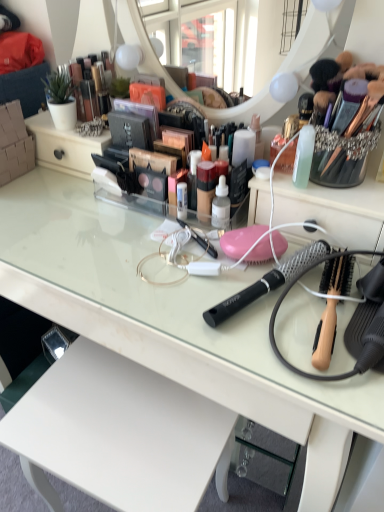
Image resolution: width=384 pixels, height=512 pixels. Describe the element at coordinates (265, 283) in the screenshot. I see `black mesh hairbrush at center, which appears as the second brush when viewed from the right` at that location.

At what (x,y) coordinates should I click in order to perform the action: click on wooden-handled hairbrush at right, the 2th brush in the left-to-right sequence. Please return your answer as a coordinate pair (x, y). Looking at the image, I should click on (331, 310).

Image resolution: width=384 pixels, height=512 pixels. I want to click on black mesh hairbrush at center, which appears as the second brush when viewed from the right, so click(x=265, y=283).

Considering the relative sizes of black mesh hairbrush at center, placed as the first brush when sorted from left to right, and wooden-handled hairbrush at right, the 2th brush in the left-to-right sequence, in the image provided, is black mesh hairbrush at center, placed as the first brush when sorted from left to right, thinner than wooden-handled hairbrush at right, the 2th brush in the left-to-right sequence,?

No.

Is point (281, 269) more distant than point (335, 278)?

Yes.

From the image's perspective, does black mesh hairbrush at center, placed as the first brush when sorted from left to right, appear higher than wooden-handled hairbrush at right, the first brush when ordered from right to left?

Yes, from the image's perspective, black mesh hairbrush at center, placed as the first brush when sorted from left to right, is over wooden-handled hairbrush at right, the first brush when ordered from right to left.

Considering the relative sizes of black mesh hairbrush at center, which appears as the second brush when viewed from the right, and wooden-handled hairbrush at right, the 2th brush in the left-to-right sequence, in the image provided, is black mesh hairbrush at center, which appears as the second brush when viewed from the right, smaller than wooden-handled hairbrush at right, the 2th brush in the left-to-right sequence,?

Correct, black mesh hairbrush at center, which appears as the second brush when viewed from the right, occupies less space than wooden-handled hairbrush at right, the 2th brush in the left-to-right sequence.

Does point (328, 298) appear closer or farther from the camera than point (371, 418)?

Point (328, 298).

You are a GUI agent. You are given a task and a screenshot of the screen. Output one action in this format:
    pyautogui.click(x=<x>, y=<y>)
    Task: Click on the desk in front of the wooden-handled hairbrush at right, the first brush when ordered from right to left
    Image resolution: width=384 pixels, height=512 pixels.
    Given the screenshot: What is the action you would take?
    pyautogui.click(x=172, y=321)

In the scene shown: Is wooden-handled hairbrush at right, the 2th brush in the left-to-right sequence, outside of clear glass desk at center?

Absolutely, wooden-handled hairbrush at right, the 2th brush in the left-to-right sequence, is external to clear glass desk at center.

Does wooden-handled hairbrush at right, the first brush when ordered from right to left, lie in front of clear glass desk at center?

No, wooden-handled hairbrush at right, the first brush when ordered from right to left, is behind clear glass desk at center.

Is clear glass desk at center located within metallic gold makeup at upper left?

No.

From a real-world perspective, is metallic gold makeup at upper left over clear glass desk at center?

Yes, from a real-world perspective, metallic gold makeup at upper left is above clear glass desk at center.

From the picture: Does metallic gold makeup at upper left turn towards clear glass desk at center?

No.

Considering the positions of objects metallic gold makeup at upper left and clear glass desk at center in the image provided, who is more to the left, metallic gold makeup at upper left or clear glass desk at center?

Positioned to the left is metallic gold makeup at upper left.

Is black mesh hairbrush at center, which appears as the second brush when viewed from the right, at the left side of clear glass desk at center?

In fact, black mesh hairbrush at center, which appears as the second brush when viewed from the right, is to the right of clear glass desk at center.

Which is closer to the camera, [288,278] or [295,297]?

Point [288,278].

From the image's perspective, which one is positioned higher, black mesh hairbrush at center, placed as the first brush when sorted from left to right, or clear glass desk at center?

black mesh hairbrush at center, placed as the first brush when sorted from left to right, is shown above in the image.

Considering the positions of objects black mesh hairbrush at center, which appears as the second brush when viewed from the right, and clear glass desk at center in the image provided, who is behind, black mesh hairbrush at center, which appears as the second brush when viewed from the right, or clear glass desk at center?

black mesh hairbrush at center, which appears as the second brush when viewed from the right.

Can you confirm if black mesh hairbrush at center, placed as the first brush when sorted from left to right, is bigger than metallic gold makeup at upper left?

Incorrect, black mesh hairbrush at center, placed as the first brush when sorted from left to right, is not larger than metallic gold makeup at upper left.

Is black mesh hairbrush at center, placed as the first brush when sorted from left to right, shorter than metallic gold makeup at upper left?

Yes.

Looking at this image, would you say metallic gold makeup at upper left is part of black mesh hairbrush at center, which appears as the second brush when viewed from the right,'s contents?

No, metallic gold makeup at upper left is not surrounded by black mesh hairbrush at center, which appears as the second brush when viewed from the right.

From the image's perspective, relative to metallic gold makeup at upper left, is black mesh hairbrush at center, which appears as the second brush when viewed from the right, above or below?

From the image's perspective, black mesh hairbrush at center, which appears as the second brush when viewed from the right, appears below metallic gold makeup at upper left.

From the picture: Considering the positions of objects metallic gold makeup at upper left and black mesh hairbrush at center, placed as the first brush when sorted from left to right, in the image provided, who is in front, metallic gold makeup at upper left or black mesh hairbrush at center, placed as the first brush when sorted from left to right,?

black mesh hairbrush at center, placed as the first brush when sorted from left to right, is more forward.

Is metallic gold makeup at upper left taller than black mesh hairbrush at center, placed as the first brush when sorted from left to right?

Yes, metallic gold makeup at upper left is taller than black mesh hairbrush at center, placed as the first brush when sorted from left to right.

Are metallic gold makeup at upper left and black mesh hairbrush at center, which appears as the second brush when viewed from the right, located far from each other?

That's not correct — metallic gold makeup at upper left is a little close to black mesh hairbrush at center, which appears as the second brush when viewed from the right.

Considering the relative sizes of metallic gold makeup at upper left and black mesh hairbrush at center, which appears as the second brush when viewed from the right, in the image provided, is metallic gold makeup at upper left wider than black mesh hairbrush at center, which appears as the second brush when viewed from the right,?

No.

Is there a large distance between wooden-handled hairbrush at right, the 2th brush in the left-to-right sequence, and black mesh hairbrush at center, placed as the first brush when sorted from left to right?

No.

Would you say wooden-handled hairbrush at right, the 2th brush in the left-to-right sequence, is inside or outside black mesh hairbrush at center, placed as the first brush when sorted from left to right?

wooden-handled hairbrush at right, the 2th brush in the left-to-right sequence, is spatially situated outside black mesh hairbrush at center, placed as the first brush when sorted from left to right.

What's the angular difference between wooden-handled hairbrush at right, the first brush when ordered from right to left, and black mesh hairbrush at center, placed as the first brush when sorted from left to right,'s facing directions?

The facing directions of wooden-handled hairbrush at right, the first brush when ordered from right to left, and black mesh hairbrush at center, placed as the first brush when sorted from left to right, are 29.5 degrees apart.

Identify the location of brush below the black mesh hairbrush at center, which appears as the second brush when viewed from the right (from the image's perspective). (331, 310).

The width and height of the screenshot is (384, 512). I want to click on brush located above the wooden-handled hairbrush at right, the first brush when ordered from right to left (from the image's perspective), so click(265, 283).

At what (x,y) coordinates should I click in order to perform the action: click on the 1st brush behind the clear glass desk at center. Please return your answer as a coordinate pair (x, y). Image resolution: width=384 pixels, height=512 pixels. Looking at the image, I should click on (331, 310).

Estimate the real-world distances between objects in this image. Which object is further from wooden-handled hairbrush at right, the first brush when ordered from right to left, black mesh hairbrush at center, which appears as the second brush when viewed from the right, or clear glass desk at center?

The object further to wooden-handled hairbrush at right, the first brush when ordered from right to left, is clear glass desk at center.

Based on their spatial positions, is clear glass desk at center or wooden-handled hairbrush at right, the 2th brush in the left-to-right sequence, closer to metallic gold makeup at upper left?

clear glass desk at center is closer to metallic gold makeup at upper left.

From the image, which object appears to be farther from metallic gold makeup at upper left, wooden-handled hairbrush at right, the 2th brush in the left-to-right sequence, or clear glass desk at center?

Among the two, wooden-handled hairbrush at right, the 2th brush in the left-to-right sequence, is located further to metallic gold makeup at upper left.

Considering their positions, is clear glass desk at center positioned closer to wooden-handled hairbrush at right, the 2th brush in the left-to-right sequence, than metallic gold makeup at upper left?

Among the two, clear glass desk at center is located nearer to wooden-handled hairbrush at right, the 2th brush in the left-to-right sequence.

Based on their spatial positions, is clear glass desk at center or black mesh hairbrush at center, placed as the first brush when sorted from left to right, closer to wooden-handled hairbrush at right, the 2th brush in the left-to-right sequence?

black mesh hairbrush at center, placed as the first brush when sorted from left to right, lies closer to wooden-handled hairbrush at right, the 2th brush in the left-to-right sequence, than the other object.

Which object lies further to the anchor point wooden-handled hairbrush at right, the first brush when ordered from right to left, metallic gold makeup at upper left or black mesh hairbrush at center, which appears as the second brush when viewed from the right?

Among the two, metallic gold makeup at upper left is located further to wooden-handled hairbrush at right, the first brush when ordered from right to left.

Considering their positions, is clear glass desk at center positioned closer to black mesh hairbrush at center, placed as the first brush when sorted from left to right, than metallic gold makeup at upper left?

The object closer to black mesh hairbrush at center, placed as the first brush when sorted from left to right, is clear glass desk at center.

Estimate the real-world distances between objects in this image. Which object is further from black mesh hairbrush at center, which appears as the second brush when viewed from the right, clear glass desk at center or wooden-handled hairbrush at right, the 2th brush in the left-to-right sequence?

Among the two, clear glass desk at center is located further to black mesh hairbrush at center, which appears as the second brush when viewed from the right.

This screenshot has height=512, width=384. What are the coordinates of `brush between metallic gold makeup at upper left and wooden-handled hairbrush at right, the 2th brush in the left-to-right sequence, in the up-down direction` in the screenshot? It's located at (265, 283).

This screenshot has width=384, height=512. I want to click on brush located between clear glass desk at center and wooden-handled hairbrush at right, the first brush when ordered from right to left, in the left-right direction, so click(265, 283).